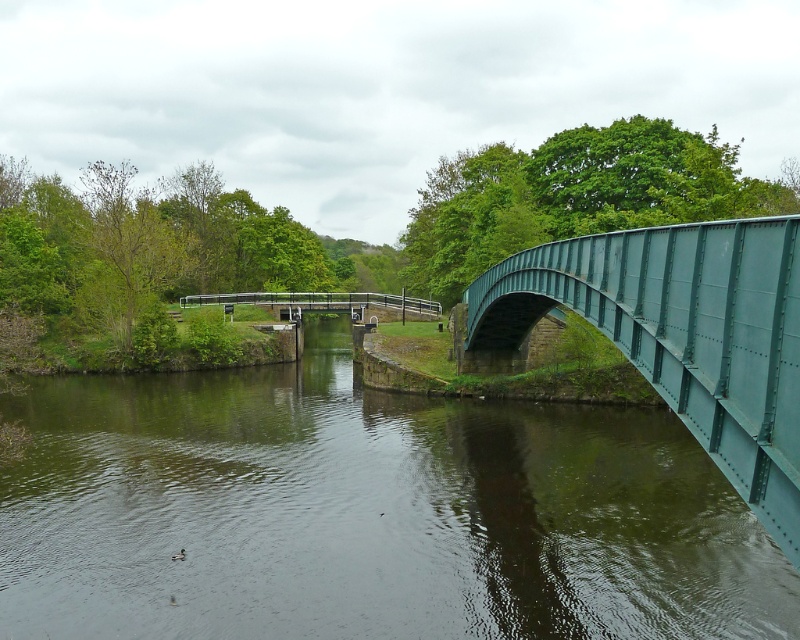
Is green metallic river at center wider than green metallic bridge at right?

Indeed, green metallic river at center has a greater width compared to green metallic bridge at right.

Can you confirm if green metallic river at center is taller than green metallic bridge at right?

No.

Which is behind, point (476, 412) or point (740, 301)?

The point (476, 412) is behind.

Locate an element on the screen. Image resolution: width=800 pixels, height=640 pixels. green metallic river at center is located at coordinates (368, 515).

Describe the element at coordinates (682, 336) in the screenshot. The image size is (800, 640). I see `green metallic bridge at right` at that location.

Is point (744, 474) closer to camera compared to point (392, 310)?

Yes, point (744, 474) is in front of point (392, 310).

I want to click on green metallic bridge at right, so click(x=682, y=336).

Describe the element at coordinates (368, 515) in the screenshot. I see `green metallic river at center` at that location.

Where is `green metallic river at center`? green metallic river at center is located at coordinates (368, 515).

Where is `green metallic river at center`? green metallic river at center is located at coordinates (368, 515).